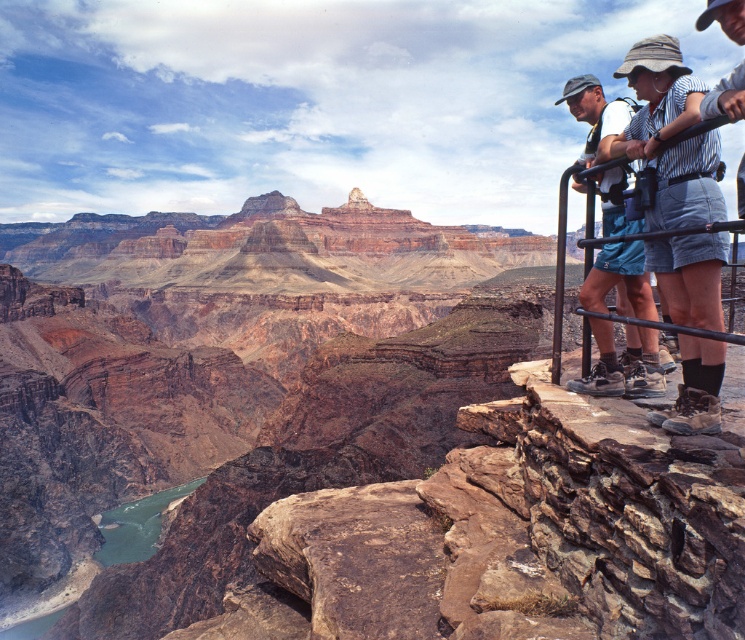
Question: Is denim shorts at center above matte blue shorts at right?

Choices:
 (A) no
 (B) yes

Answer: (A)

Question: Is rustic rock canyon at upper center positioned in front of denim shorts at center?

Choices:
 (A) yes
 (B) no

Answer: (B)

Question: Which of the following is the farthest from the observer?

Choices:
 (A) rustic rock canyon at upper center
 (B) denim shorts at center
 (C) matte blue shorts at right

Answer: (A)

Question: Where is rustic rock canyon at upper center located in relation to matte blue shorts at right in the image?

Choices:
 (A) left
 (B) right

Answer: (B)

Question: Which point is farther from the camera taking this photo?

Choices:
 (A) (583, 288)
 (B) (694, 122)
 (C) (437, 321)

Answer: (C)

Question: Considering the real-world distances, which object is farthest from the rustic rock canyon at upper center?

Choices:
 (A) denim shorts at center
 (B) matte blue shorts at right

Answer: (B)